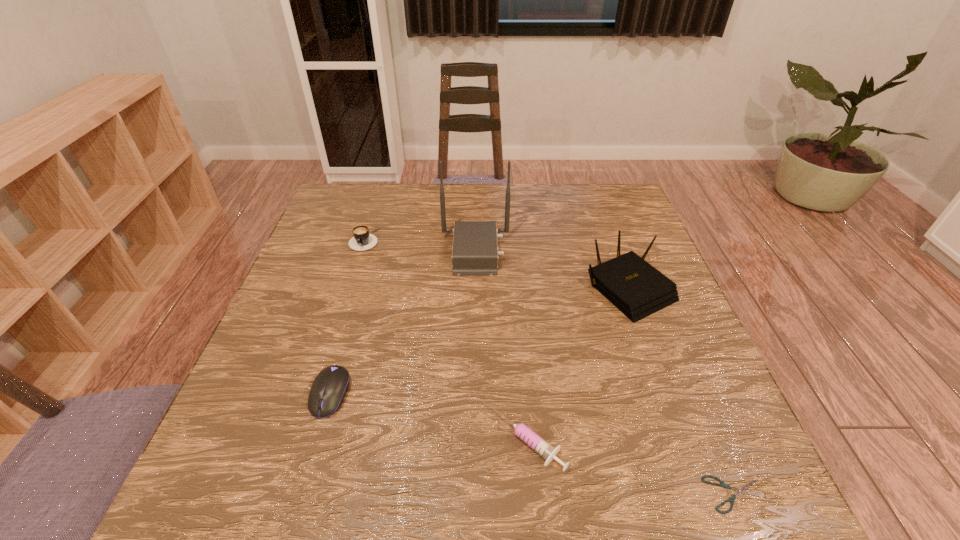
Identify the location of shears located in the right edge section of the desktop. The width and height of the screenshot is (960, 540). (743, 489).

Identify the location of object that is positioned at the near right corner. Image resolution: width=960 pixels, height=540 pixels. (743, 489).

Locate an element on the screen. vacant space at the far edge of the desktop is located at coordinates (462, 191).

Where is `vacant space at the near edge`? This screenshot has height=540, width=960. vacant space at the near edge is located at coordinates [612, 498].

Where is `blank space at the left edge of the desktop`? This screenshot has width=960, height=540. blank space at the left edge of the desktop is located at coordinates (315, 322).

Find the location of a particular element. The image size is (960, 540). vacant space at the right edge of the desktop is located at coordinates 679,414.

At what (x,y) coordinates should I click in order to perform the action: click on blank space at the far left corner of the desktop. Please return your answer as a coordinate pair (x, y). Looking at the image, I should click on (352, 205).

Identify the location of free space between the fourth shortest object and the computer mouse. The height and width of the screenshot is (540, 960). (348, 317).

Locate an element on the screen. vacant area between the fourth tallest object and the right router is located at coordinates (479, 341).

The image size is (960, 540). Find the location of `free spot between the second tallest object and the taller router`. free spot between the second tallest object and the taller router is located at coordinates (552, 270).